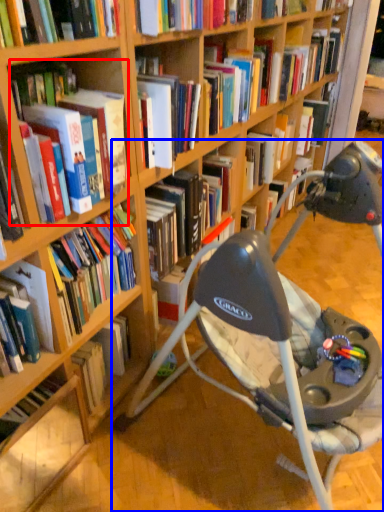
Question: Among these objects, which one is farthest to the camera, book (highlighted by a red box) or chair (highlighted by a blue box)?

Choices:
 (A) book
 (B) chair

Answer: (A)